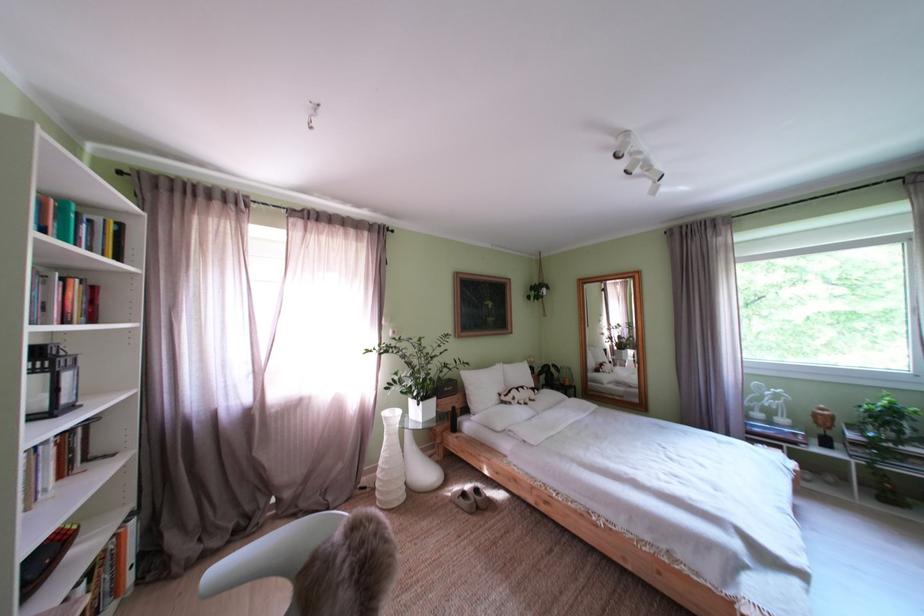
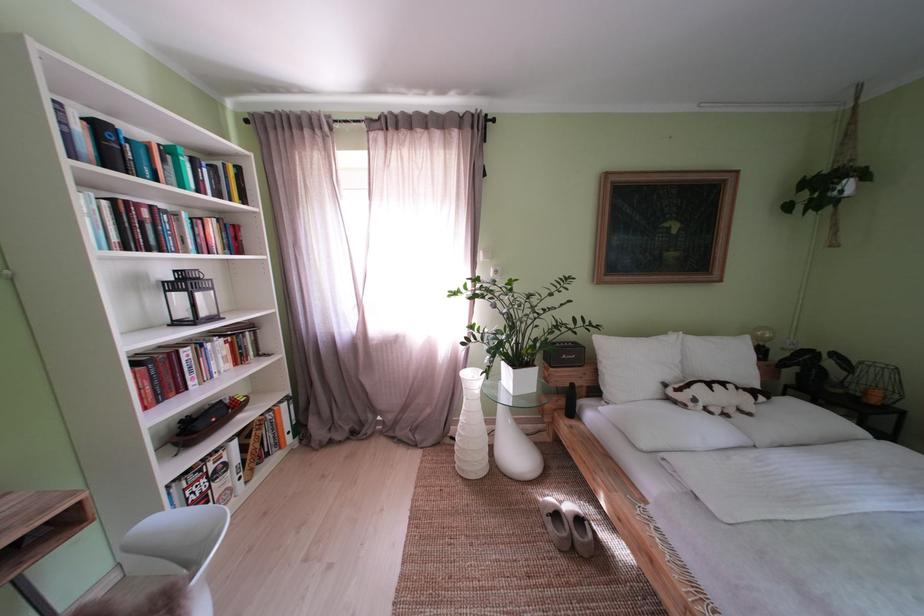
Where in the second image is the point corresponding to (x=475, y=500) from the first image?

(567, 521)